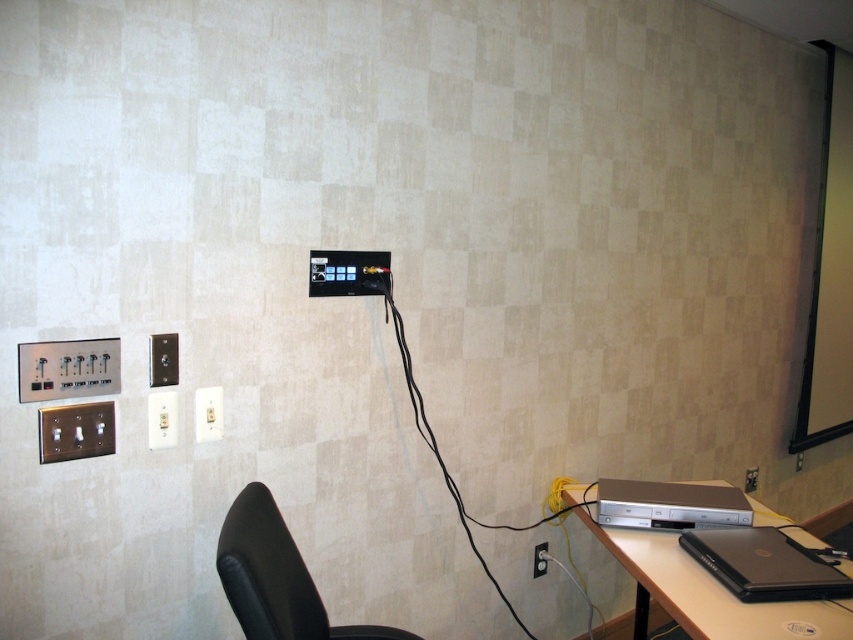
Which is behind, point (170, 404) or point (747, 468)?

The point (747, 468) is behind.

Between white plastic light switch at lower left and black plastic electrical outlet at lower right, which one has less height?

black plastic electrical outlet at lower right

Does point (158, 442) come in front of point (744, 477)?

Yes, it is.

Identify the location of white plastic light switch at lower left. (161, 419).

Who is shorter, white plastic light switch at lower left or black plastic electrical outlet at center?

black plastic electrical outlet at center is shorter.

Can you confirm if white plastic light switch at lower left is positioned to the right of black plastic electrical outlet at center?

No, white plastic light switch at lower left is not to the right of black plastic electrical outlet at center.

Locate an element on the screen. white plastic light switch at lower left is located at coordinates (161, 419).

Based on the photo, is silver metallic computer desk at lower right below white plastic light switch at lower left?

A: Yes.

Is point (688, 609) positioned in front of point (175, 420)?

Yes, it is.

Find the location of `silver metallic computer desk at lower right`. silver metallic computer desk at lower right is located at coordinates (706, 593).